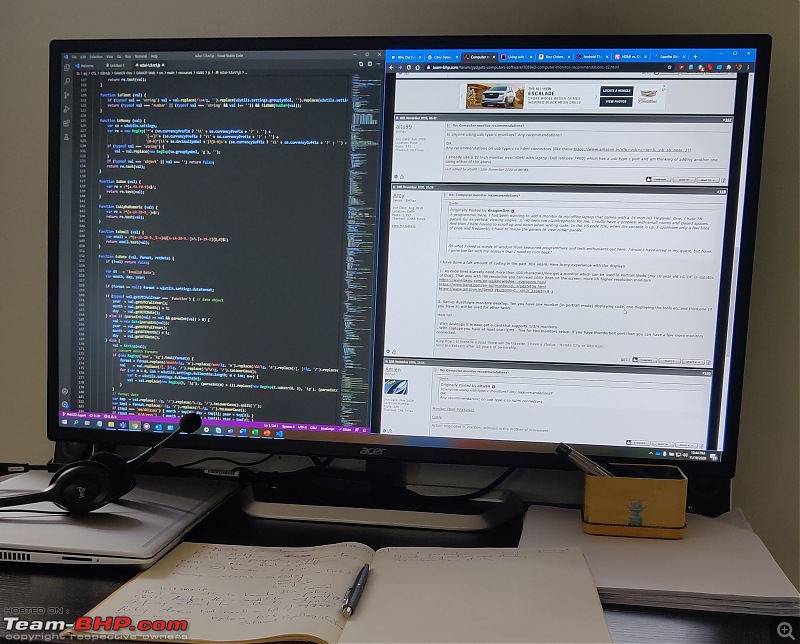
Locate an element on the screen. The image size is (800, 644). corner of moniter is located at coordinates (729, 475), (48, 437), (54, 44), (758, 44).